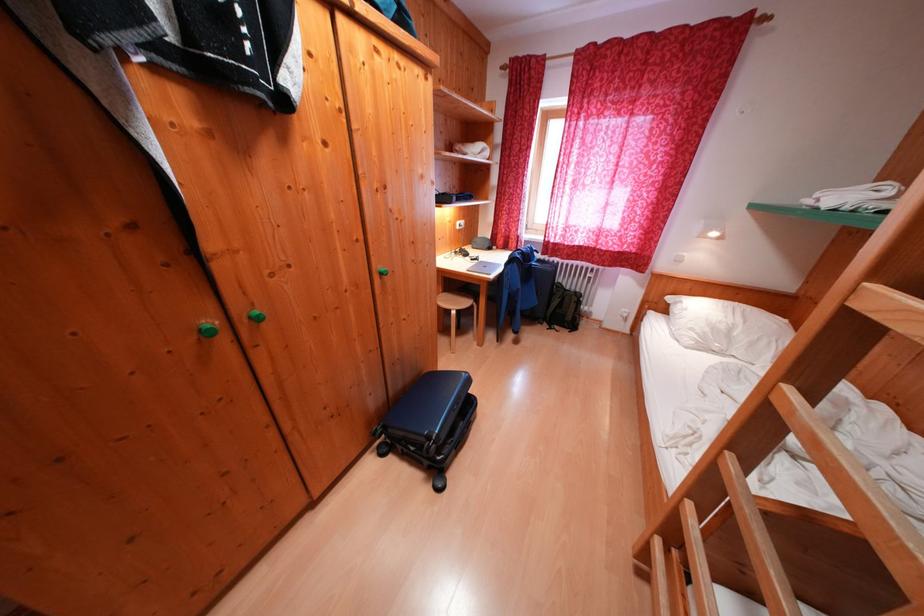
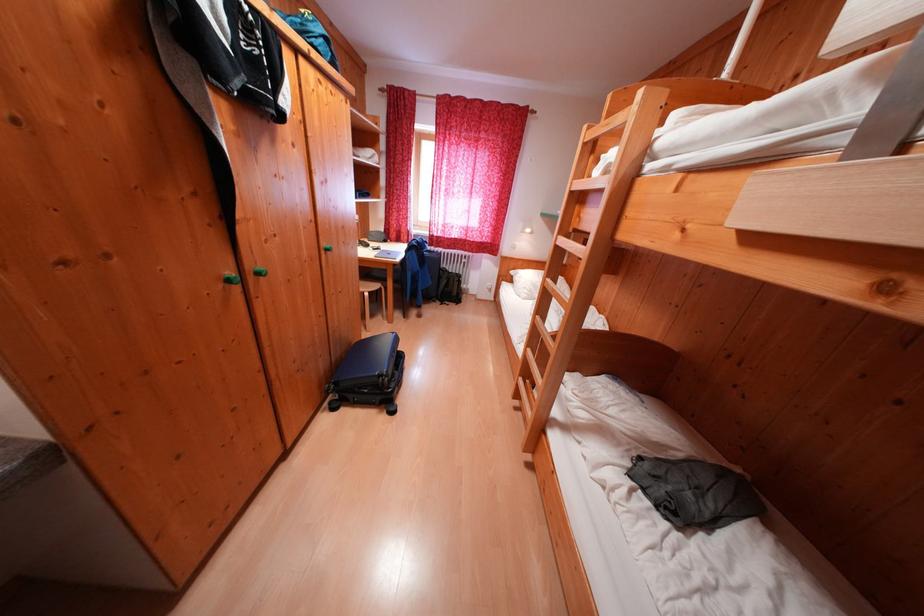
Where in the second image is the point corresponding to point 699,509 from the first image?

(537, 354)